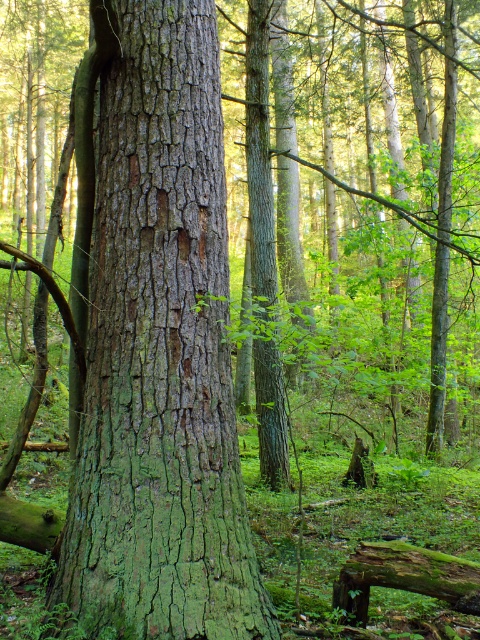
From the picture: You are standing in the forest and see the point marked at coordinates (159,356). What does this point indicate?

The point at coordinates (159,356) indicates the location of the green rough bark tree trunk at center.

You are a hiker who wants to cross the forest floor. You see the green rough bark tree trunk at center and the green mossy log at lower right. Which object is wider and can provide a sturdier base for walking?

The green rough bark tree trunk at center is wider than the green mossy log at lower right, so it can provide a sturdier base for walking.

Looking at this image, you are a hiker trying to cross a forest path. You see the green rough bark tree trunk at center and the green mossy log at lower right. Which object would you need to step over if you want to avoid stepping on them both?

You would need to step over the green mossy log at lower right because it is smaller in size than the green rough bark tree trunk at center, making it easier to navigate around.